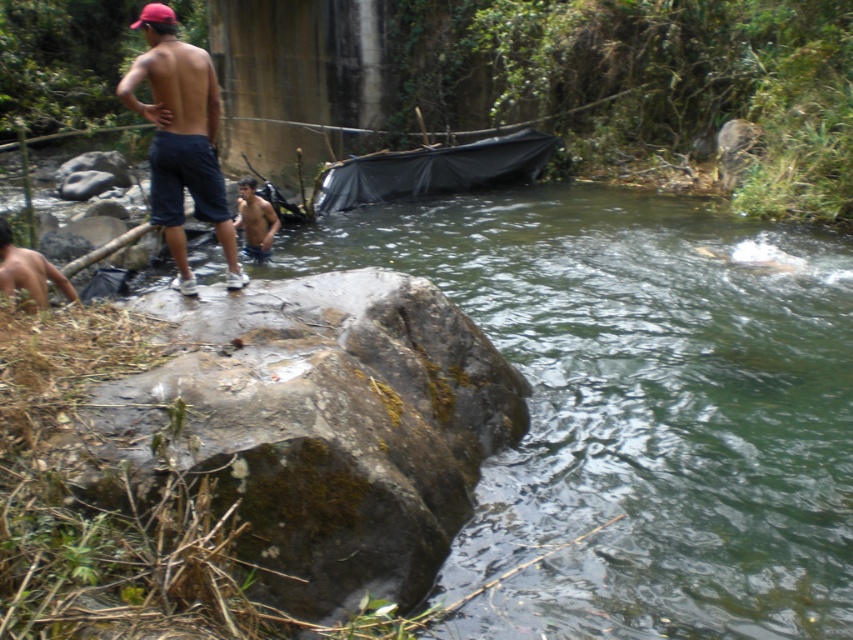
Question: Can you confirm if green mossy rock at center is wider than brown skin boy at lower left?

Choices:
 (A) no
 (B) yes

Answer: (B)

Question: Is mossy stone boulder at lower left in front of brown skin boy at lower left?

Choices:
 (A) no
 (B) yes

Answer: (B)

Question: Which point is farther to the camera?

Choices:
 (A) dark blue denim shorts at upper left
 (B) green mossy rock at center

Answer: (A)

Question: Where is mossy stone boulder at lower left located in relation to brown skin man at center in the image?

Choices:
 (A) left
 (B) right

Answer: (B)

Question: Which point is farther to the camera?

Choices:
 (A) green mossy rock at center
 (B) dark blue denim shorts at upper left
 (C) brown skin man at center
 (D) brown skin boy at lower left

Answer: (C)

Question: Which object appears farthest from the camera in this image?

Choices:
 (A) green mossy rock at center
 (B) dark blue denim shorts at upper left
 (C) brown skin boy at lower left
 (D) mossy stone boulder at lower left

Answer: (C)